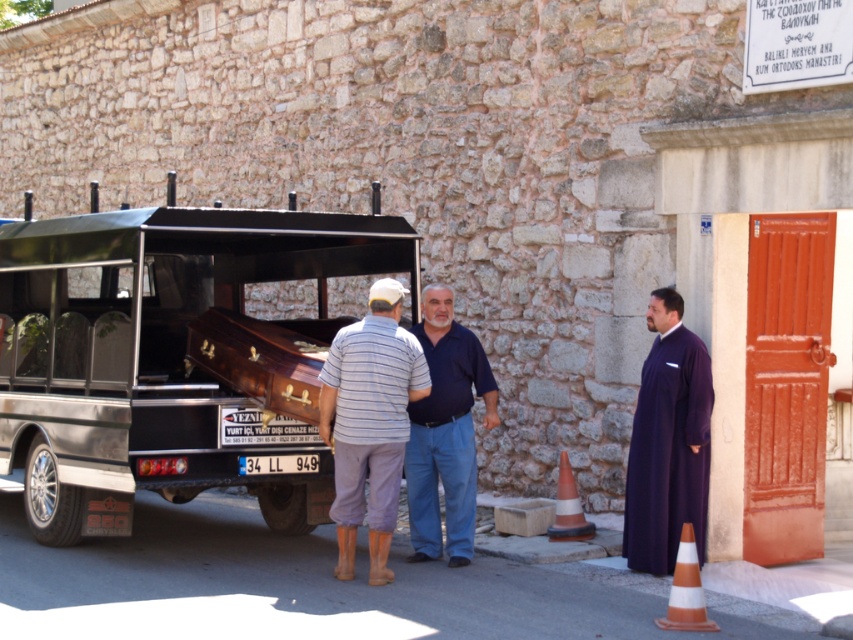
Can you confirm if striped cotton shirt at center is bigger than white plastic license plate at center?

Indeed, striped cotton shirt at center has a larger size compared to white plastic license plate at center.

Is striped cotton shirt at center above white plastic license plate at center?

Yes.

Measure the distance between striped cotton shirt at center and camera.

They are 27.26 feet apart.

Find the location of a particular element. Image resolution: width=853 pixels, height=640 pixels. striped cotton shirt at center is located at coordinates (412, 438).

You are a GUI agent. You are given a task and a screenshot of the screen. Output one action in this format:
    pyautogui.click(x=<x>, y=<y>)
    Task: Click on the wooden polished casket at center
    This screenshot has width=853, height=640.
    Given the screenshot: What is the action you would take?
    pyautogui.click(x=169, y=356)

Where is `wooden polished casket at center`? The image size is (853, 640). wooden polished casket at center is located at coordinates (169, 356).

Locate an element on the screen. striped cotton shirt at center is located at coordinates (412, 438).

Who is positioned more to the left, striped cotton shirt at center or purple matte robe at center?

Positioned to the left is purple matte robe at center.

Which is behind, point (380, 577) or point (405, 374)?

Point (405, 374)

Identify the location of striped cotton shirt at center. The width and height of the screenshot is (853, 640). (412, 438).